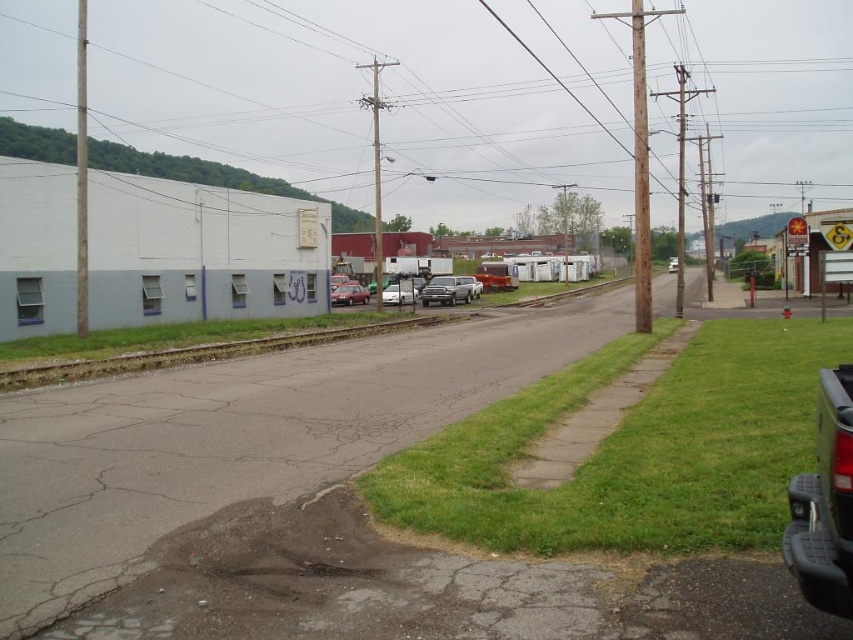
Question: Estimate the real-world distances between objects in this image. Which object is closer to the brown wooden utility pole at upper center?

Choices:
 (A) green grass at lower right
 (B) metallic red car at center

Answer: (B)

Question: Which point is closer to the camera taking this photo?

Choices:
 (A) (837, 51)
 (B) (445, 282)

Answer: (B)

Question: Is green grass at lower right behind shiny silver sedan at center?

Choices:
 (A) yes
 (B) no

Answer: (B)

Question: Is satin silver truck at center thinner than shiny silver sedan at center?

Choices:
 (A) no
 (B) yes

Answer: (A)

Question: Is brown wooden utility pole at upper center closer to camera compared to metallic red car at center?

Choices:
 (A) yes
 (B) no

Answer: (B)

Question: Which of the following is the closest to the observer?

Choices:
 (A) (357, 304)
 (B) (445, 292)

Answer: (B)